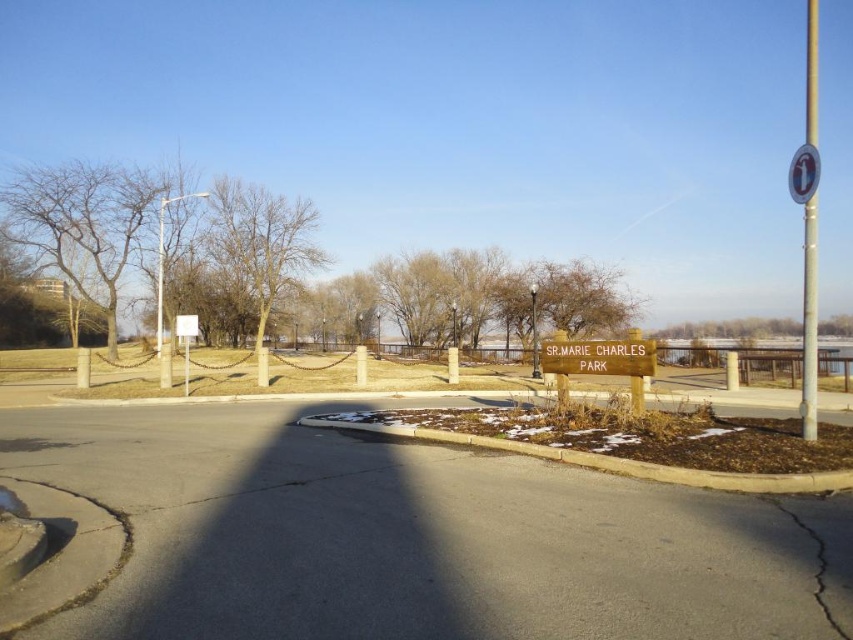
Question: Is bare wood tree at center thinner than brown mulch at lower center?

Choices:
 (A) yes
 (B) no

Answer: (B)

Question: From the image, what is the correct spatial relationship of bare wood tree at center in relation to brown mulch at lower center?

Choices:
 (A) left
 (B) right

Answer: (A)

Question: Which point is farther from the camera taking this photo?

Choices:
 (A) (820, 579)
 (B) (554, 371)

Answer: (B)

Question: Does brown mulch at lower center appear over black asphalt crack at lower right?

Choices:
 (A) no
 (B) yes

Answer: (B)

Question: Among these objects, which one is nearest to the camera?

Choices:
 (A) white plastic circle at upper right
 (B) brown mulch at lower center
 (C) black asphalt crack at lower right

Answer: (C)

Question: Based on their relative distances, which object is nearer to the bare branches at left?

Choices:
 (A) white plastic circle at upper right
 (B) bare wood tree at center
 (C) brown wooden sign at center

Answer: (B)